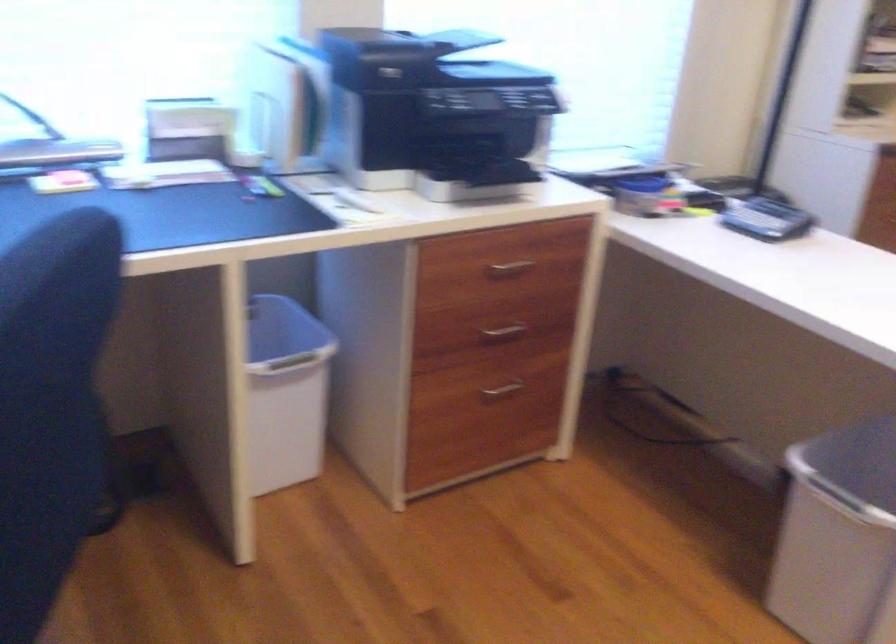
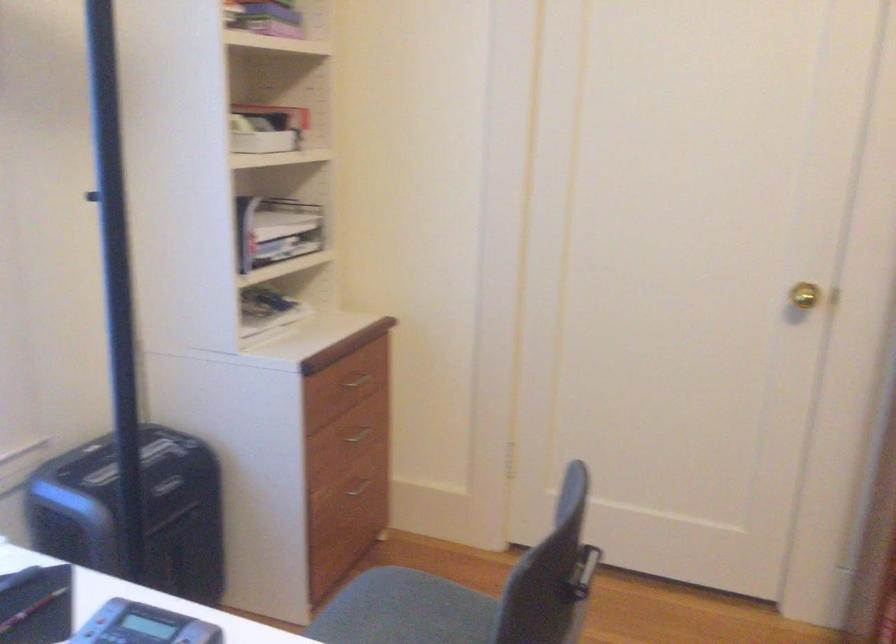
Question: The images are taken continuously from a first-person perspective. In which direction is your viewpoint rotating?

Choices:
 (A) Left
 (B) Right
 (C) Up
 (D) Down

Answer: (B)